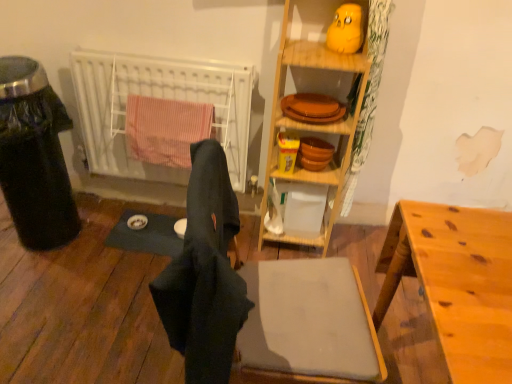
At what (x,y) coordinates should I click in order to perform the action: click on free spot to the left of dark gray fabric yoga mat at center. Please return your answer as a coordinate pair (x, y). The width and height of the screenshot is (512, 384). Looking at the image, I should click on (90, 225).